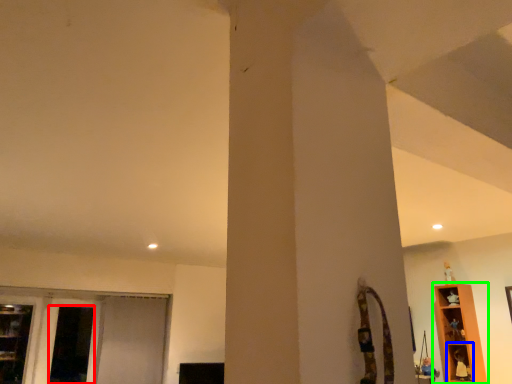
Question: Considering the real-world distances, which object is closest to screen door (highlighted by a red box)? shelf (highlighted by a blue box) or shelf (highlighted by a green box).

Choices:
 (A) shelf
 (B) shelf

Answer: (B)